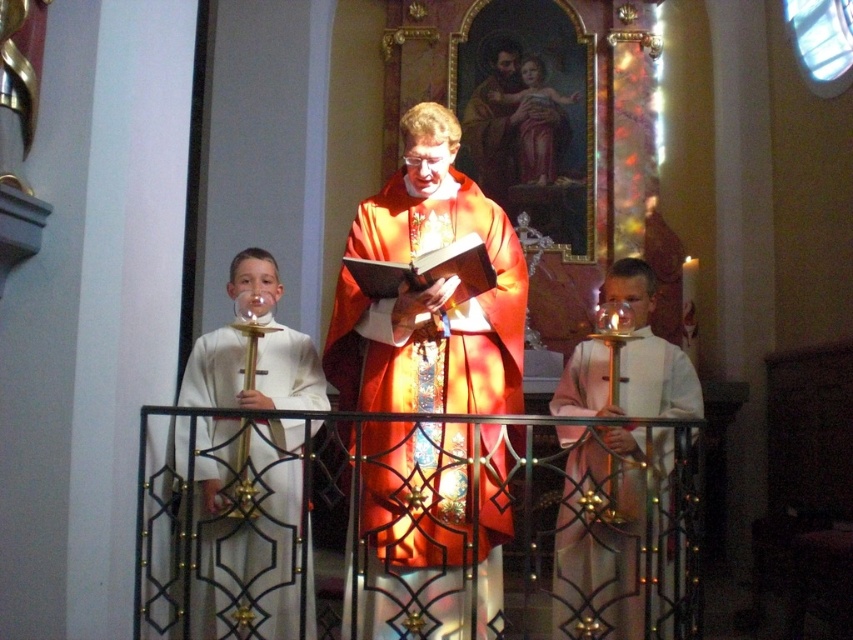
Based on the scene described, which object, the white satin robe at left or the matte gold statue at upper center, has a greater width? Please consider the spatial details provided in the description.

The white satin robe at left might be wider than matte gold statue at upper center according to the description.

You are an attendee at this religious ceremony and want to know which robe is closer to the front. Based on the shiny orange robe at center and the pink satin robe at right, which one is in front?

The shiny orange robe at center is positioned over the pink satin robe at right, so it is in front.

You are an interior designer planning to install a new lighting fixture in the church. The lighting fixture must be placed above the taller object between the white satin robe at left and the matte gold statue at upper center. Which object should the lighting fixture be positioned above?

The white satin robe at left is taller than the matte gold statue at upper center, so the lighting fixture should be positioned above the white satin robe at left.